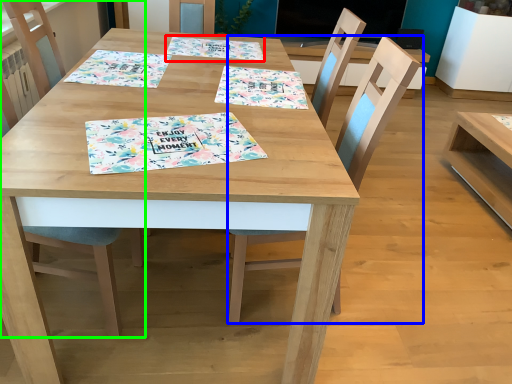
Question: Considering the real-world distances, which object is closest to tablecloth (highlighted by a red box)? chair (highlighted by a blue box) or chair (highlighted by a green box).

Choices:
 (A) chair
 (B) chair

Answer: (A)